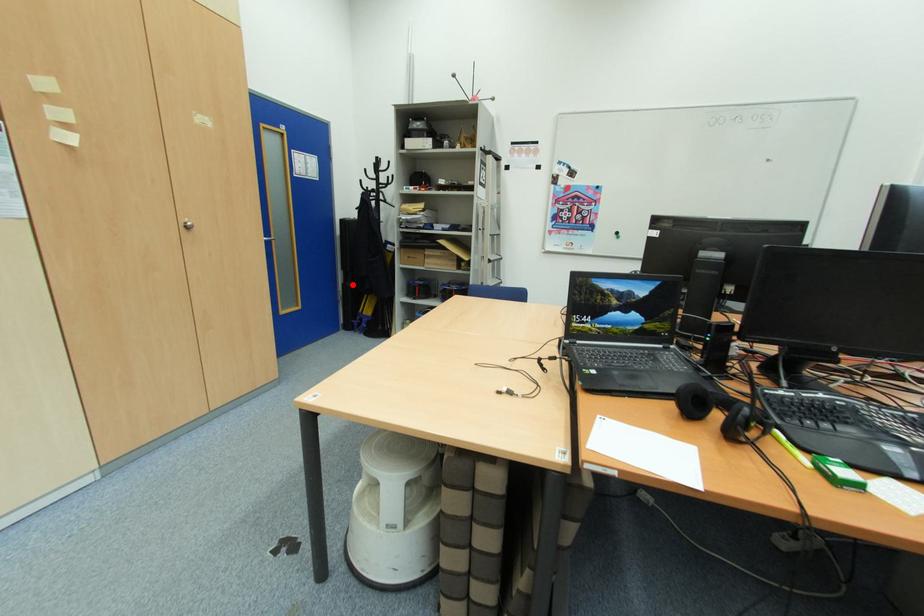
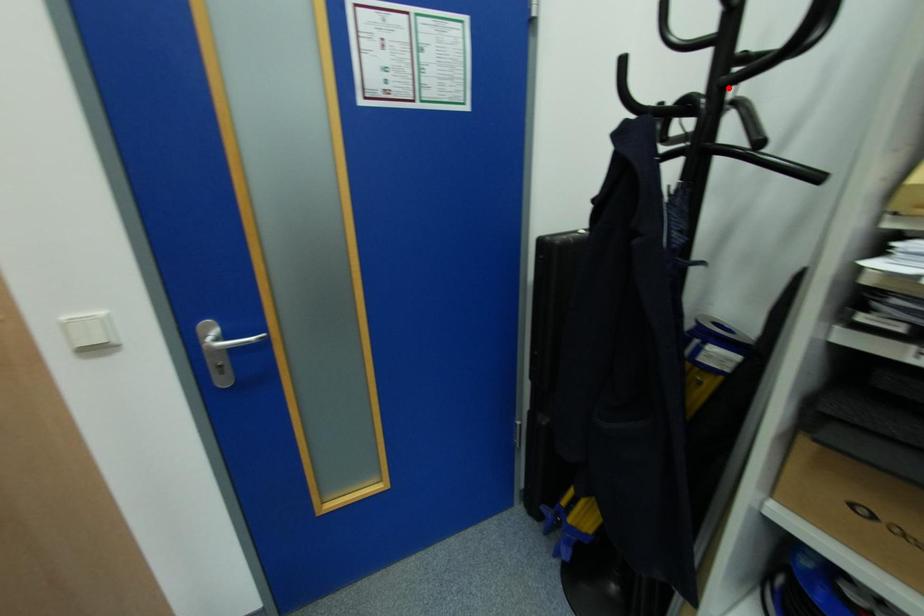
I am providing you with two images of the same scene from different viewpoints. A red point is marked on the first image and another point is marked on the second image. Are the points marked in image1 and image2 representing the same 3D position?

No